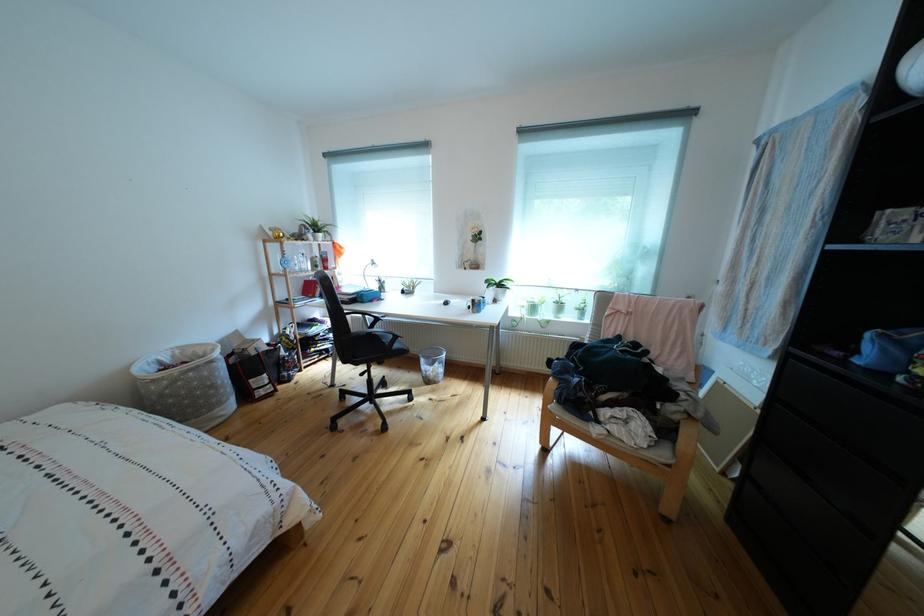
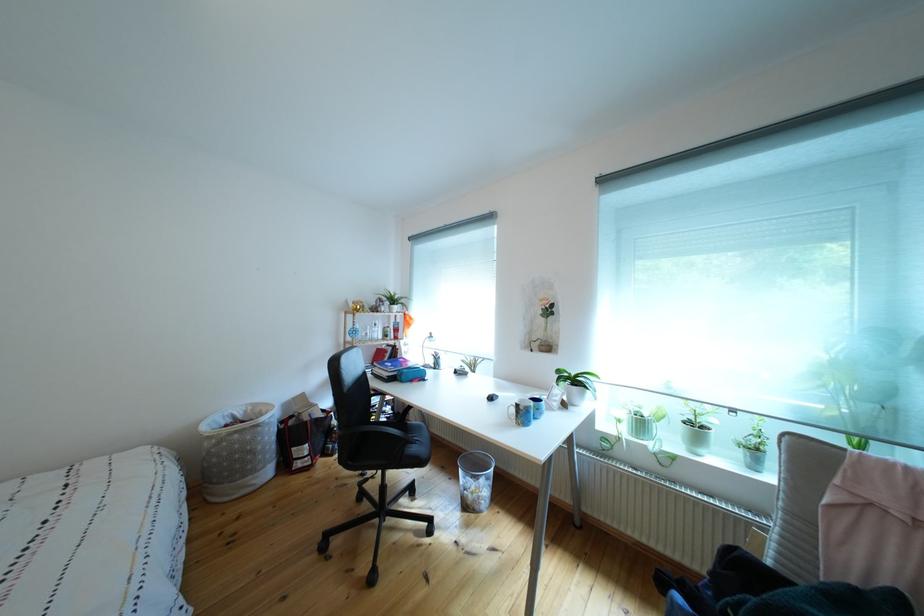
The point at (544,314) is marked in the first image. Where is the corresponding point in the second image?

(652, 430)